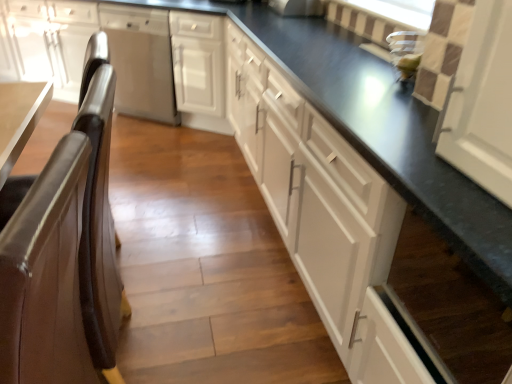
Question: Is brown leather chair at left oriented towards white matte cabinet at center, arranged as the second cabinetry when viewed from the right?

Choices:
 (A) yes
 (B) no

Answer: (B)

Question: Does brown leather chair at left have a larger size compared to white matte cabinet at center, arranged as the second cabinetry when viewed from the right?

Choices:
 (A) yes
 (B) no

Answer: (B)

Question: Does brown leather chair at left have a smaller size compared to white matte cabinet at center, which is the 2th cabinetry in left-to-right order?

Choices:
 (A) no
 (B) yes

Answer: (B)

Question: Would you say brown leather chair at left is outside white matte cabinet at center, arranged as the second cabinetry when viewed from the right?

Choices:
 (A) yes
 (B) no

Answer: (A)

Question: Can you confirm if brown leather chair at left is taller than white matte cabinet at center, which is the 2th cabinetry in left-to-right order?

Choices:
 (A) yes
 (B) no

Answer: (A)

Question: From a real-world perspective, is white matte cabinet at center, which is the 2th cabinetry in left-to-right order, above or below satin stainless steel dishwasher at left, which is the third cabinetry from right to left?

Choices:
 (A) below
 (B) above

Answer: (B)

Question: Considering the positions of point (215, 18) and point (64, 66), is point (215, 18) closer or farther from the camera than point (64, 66)?

Choices:
 (A) farther
 (B) closer

Answer: (B)

Question: Based on their positions, is white matte cabinet at center, which is the 2th cabinetry in left-to-right order, located to the left or right of satin stainless steel dishwasher at left, which is the third cabinetry from right to left?

Choices:
 (A) right
 (B) left

Answer: (A)

Question: Considering the positions of white matte cabinet at center, arranged as the second cabinetry when viewed from the right, and satin stainless steel dishwasher at left, marked as the 1th cabinetry in a left-to-right arrangement, in the image, is white matte cabinet at center, arranged as the second cabinetry when viewed from the right, bigger or smaller than satin stainless steel dishwasher at left, marked as the 1th cabinetry in a left-to-right arrangement,?

Choices:
 (A) small
 (B) big

Answer: (A)

Question: From a real-world perspective, is brown leather chair at left physically located above or below stainless steel dishwasher at center?

Choices:
 (A) above
 (B) below

Answer: (A)

Question: From the image's perspective, is brown leather chair at left positioned above or below stainless steel dishwasher at center?

Choices:
 (A) below
 (B) above

Answer: (A)

Question: Is point (90, 39) positioned closer to the camera than point (120, 29)?

Choices:
 (A) closer
 (B) farther

Answer: (A)

Question: Is brown leather chair at left bigger or smaller than stainless steel dishwasher at center?

Choices:
 (A) big
 (B) small

Answer: (B)

Question: Considering the positions of point (57, 66) and point (150, 104), is point (57, 66) closer or farther from the camera than point (150, 104)?

Choices:
 (A) farther
 (B) closer

Answer: (A)

Question: Visually, is satin stainless steel dishwasher at left, marked as the 1th cabinetry in a left-to-right arrangement, positioned to the left or to the right of stainless steel dishwasher at center?

Choices:
 (A) left
 (B) right

Answer: (A)